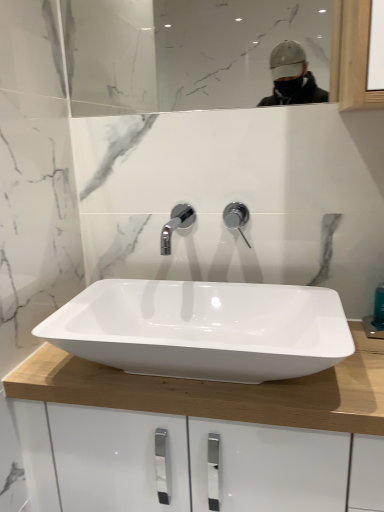
The height and width of the screenshot is (512, 384). Find the location of `polished chrome tap at center`. polished chrome tap at center is located at coordinates (236, 217).

At what (x,y) coordinates should I click in order to perform the action: click on white glossy sink at center. Please return your answer as a coordinate pair (x, y). This screenshot has height=512, width=384. Looking at the image, I should click on (203, 329).

The height and width of the screenshot is (512, 384). Identify the location of polished chrome tap at center. (236, 217).

From the picture: Is polished chrome tap at center far away from white glossy sink at center?

Actually, polished chrome tap at center and white glossy sink at center are a little close together.

Could you tell me if polished chrome tap at center is turned towards white glossy sink at center?

No, polished chrome tap at center is not turned towards white glossy sink at center.

Considering the sizes of objects polished chrome tap at center and white glossy sink at center in the image provided, who is thinner, polished chrome tap at center or white glossy sink at center?

Thinner between the two is polished chrome tap at center.

Consider the image. Is clear glass mirror at upper center next to white glossy sink at center and touching it?

No, clear glass mirror at upper center is not touching white glossy sink at center.

Which object is further away from the camera, clear glass mirror at upper center or white glossy sink at center?

clear glass mirror at upper center.

From a real-world perspective, which is physically below, clear glass mirror at upper center or white glossy sink at center?

From a 3D spatial view, white glossy sink at center is below.

Locate an element on the screen. This screenshot has width=384, height=512. sink lying on the right of clear glass mirror at upper center is located at coordinates (203, 329).

Which point is more forward, (114, 351) or (225, 214)?

The point (114, 351) is more forward.

Based on their sizes in the image, would you say white glossy sink at center is bigger or smaller than polished chrome tap at center?

Clearly, white glossy sink at center is larger in size than polished chrome tap at center.

Which object is positioned more to the right, white glossy sink at center or polished chrome tap at center?

polished chrome tap at center is more to the right.

From the image's perspective, is white glossy sink at center positioned above or below clear glass mirror at upper center?

Based on their image positions, white glossy sink at center is located beneath clear glass mirror at upper center.

Is white glossy sink at center spatially inside clear glass mirror at upper center, or outside of it?

white glossy sink at center is outside clear glass mirror at upper center.

Are white glossy sink at center and clear glass mirror at upper center making contact?

No, white glossy sink at center is not next to clear glass mirror at upper center.

Identify the location of tap beneath the clear glass mirror at upper center (from a real-world perspective). (236, 217).

Which object is positioned more to the left, clear glass mirror at upper center or polished chrome tap at center?

clear glass mirror at upper center is more to the left.

Does clear glass mirror at upper center touch polished chrome tap at center?

clear glass mirror at upper center and polished chrome tap at center are not in contact.

Does polished chrome tap at center have a greater height compared to clear glass mirror at upper center?

In fact, polished chrome tap at center may be shorter than clear glass mirror at upper center.

From the picture: Could you tell me if polished chrome tap at center is turned towards clear glass mirror at upper center?

No.

From the image's perspective, is polished chrome tap at center on clear glass mirror at upper center?

Actually, polished chrome tap at center appears below clear glass mirror at upper center in the image.

How different are the orientations of polished chrome tap at center and clear glass mirror at upper center in degrees?

polished chrome tap at center and clear glass mirror at upper center are facing 0.606 degrees away from each other.

Identify the location of sink lying on the left of polished chrome tap at center. The image size is (384, 512). (203, 329).

The width and height of the screenshot is (384, 512). In order to click on sink below the clear glass mirror at upper center (from the image's perspective) in this screenshot , I will do `click(203, 329)`.

Considering their positions, is clear glass mirror at upper center positioned closer to white glossy sink at center than polished chrome tap at center?

polished chrome tap at center is positioned closer to the anchor white glossy sink at center.

When comparing their distances from clear glass mirror at upper center, does white glossy sink at center or polished chrome tap at center seem further?

polished chrome tap at center is further to clear glass mirror at upper center.

Estimate the real-world distances between objects in this image. Which object is further from polished chrome tap at center, clear glass mirror at upper center or white glossy sink at center?

clear glass mirror at upper center is further to polished chrome tap at center.

When comparing their distances from clear glass mirror at upper center, does polished chrome tap at center or white glossy sink at center seem closer?

white glossy sink at center lies closer to clear glass mirror at upper center than the other object.

Estimate the real-world distances between objects in this image. Which object is closer to polished chrome tap at center, white glossy sink at center or clear glass mirror at upper center?

Based on the image, white glossy sink at center appears to be nearer to polished chrome tap at center.

Looking at the image, which one is located further to white glossy sink at center, polished chrome tap at center or clear glass mirror at upper center?

Among the two, clear glass mirror at upper center is located further to white glossy sink at center.

Where is `tap between clear glass mirror at upper center and white glossy sink at center in the up-down direction`? The width and height of the screenshot is (384, 512). tap between clear glass mirror at upper center and white glossy sink at center in the up-down direction is located at coordinates (236, 217).